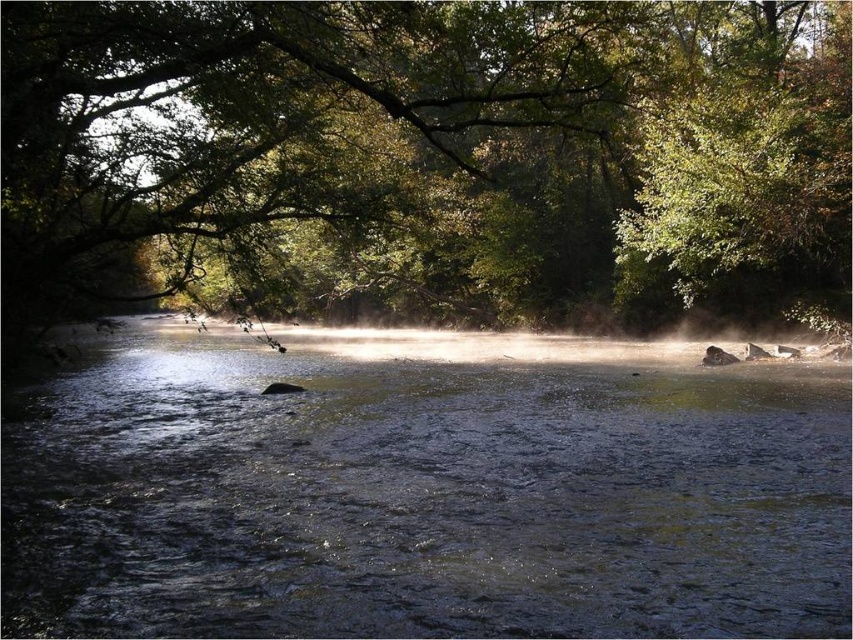
You are an environmental scientist assessing the river ecosystem. You observe the green leafy tree at center and the clear water at center. Which object occupies a greater area in the image?

The green leafy tree at center is larger in size than clear water at center, so the green leafy tree at center occupies a greater area in the image.

You are a hiker who wants to cross the river. You see the green leafy tree at center and the clear water at center. How far apart are these two landmarks?

The green leafy tree at center and the clear water at center are 10.72 meters apart from each other.

You are standing at the camera position and want to throw a stone to hit the point at coordinates point (210, 246). What is the minimum distance you need to throw the stone to reach that point?

The point at coordinates point (210, 246) is 21.61 meters away from the camera, so you need to throw the stone at least 21.61 meters to reach it.